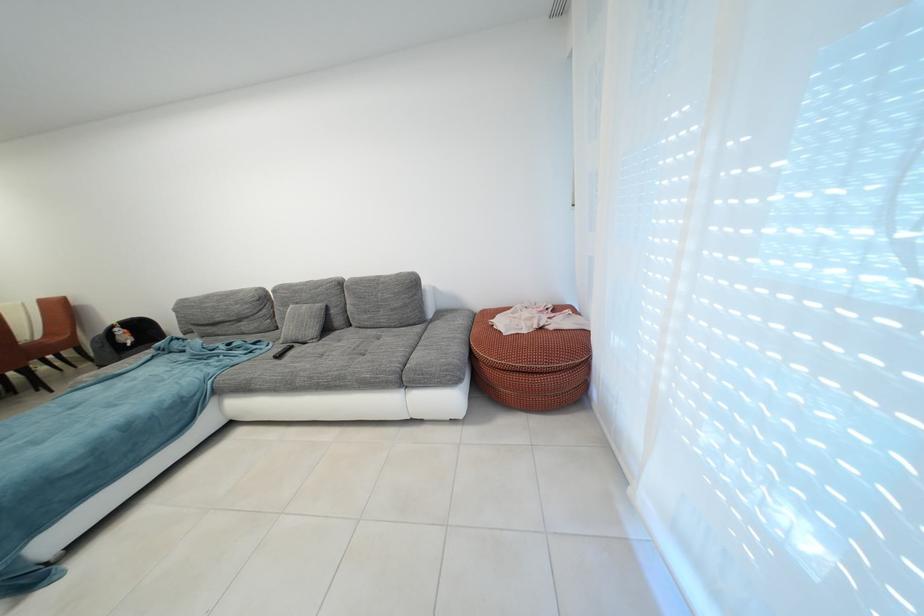
At what (x,y) coordinates should I click in order to perform the action: click on red pouf lid. Please return your answer as a coordinate pair (x, y). Looking at the image, I should click on (523, 318).